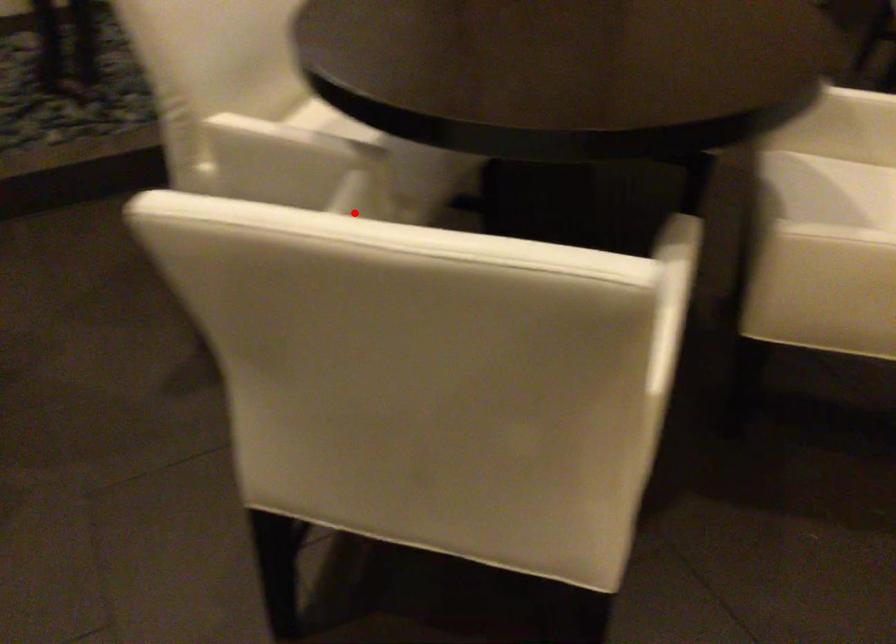
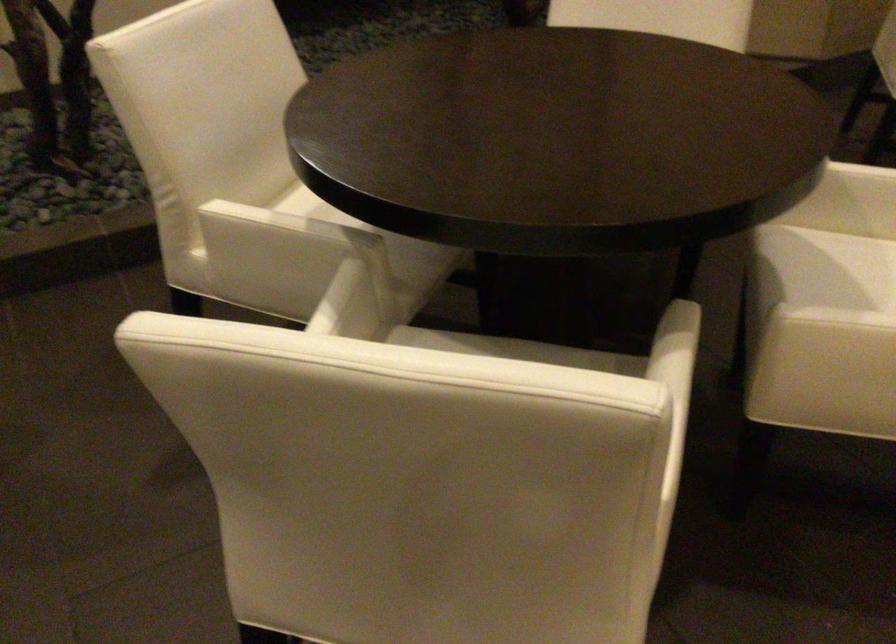
Question: I am providing you with two images of the same scene from different viewpoints. A red point is marked on the first image. At the location where the point appears in image 1, is it still visible in image 2?

Choices:
 (A) Yes
 (B) No

Answer: (A)